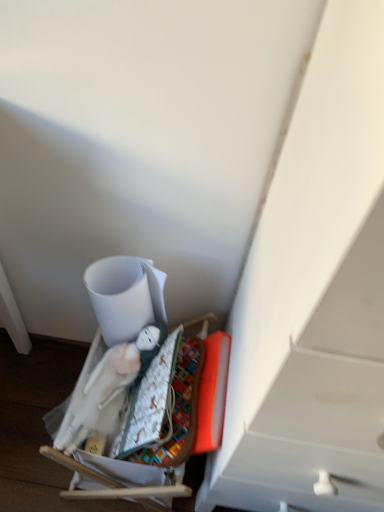
The image size is (384, 512). Describe the element at coordinates (141, 453) in the screenshot. I see `white matte baby crib at lower center` at that location.

Find the location of a particular element. The image size is (384, 512). white matte baby crib at lower center is located at coordinates (141, 453).

This screenshot has height=512, width=384. In order to click on white matte baby crib at lower center in this screenshot , I will do `click(141, 453)`.